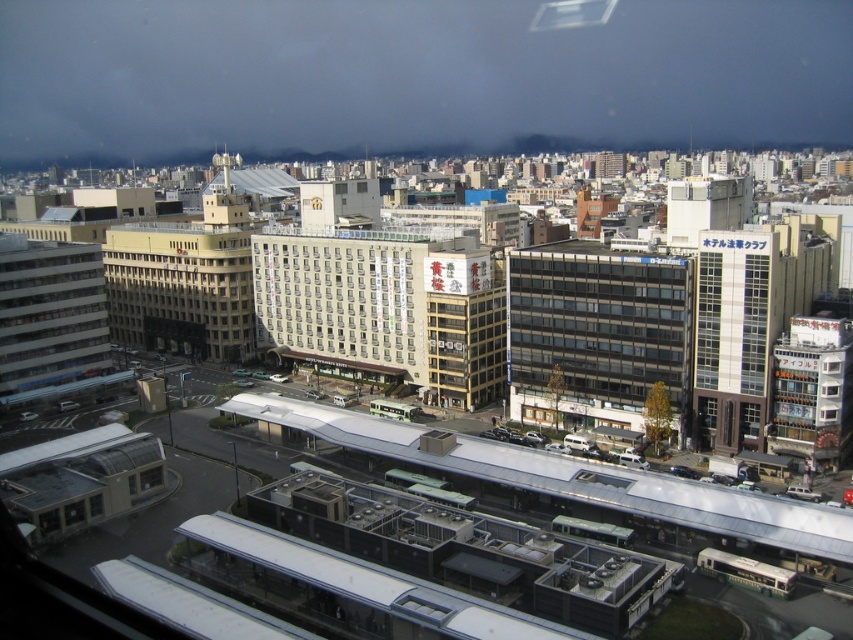
Question: Is matte glass building at center below white matte building at center?

Choices:
 (A) yes
 (B) no

Answer: (A)

Question: Among these objects, which one is farthest from the camera?

Choices:
 (A) beige concrete building at center-left
 (B) matte glass building at center
 (C) white matte building at center

Answer: (A)

Question: Is matte glass building at center further to camera compared to white matte building at center?

Choices:
 (A) no
 (B) yes

Answer: (A)

Question: Estimate the real-world distances between objects in this image. Which object is farther from the matte glass building at center?

Choices:
 (A) beige concrete building at center-left
 (B) white matte building at center

Answer: (A)

Question: Among these objects, which one is nearest to the camera?

Choices:
 (A) matte glass building at center
 (B) beige concrete building at center-left

Answer: (A)

Question: Does white matte building at center have a smaller size compared to beige concrete building at center-left?

Choices:
 (A) no
 (B) yes

Answer: (B)